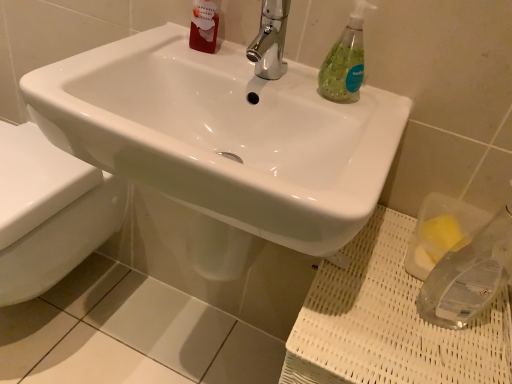
You are a GUI agent. You are given a task and a screenshot of the screen. Output one action in this format:
    pyautogui.click(x=<x>, y=<y>)
    Task: Click on the vacant area that lies to the right of translucent red liquid at upper left
    Image resolution: width=512 pixels, height=384 pixels.
    Given the screenshot: What is the action you would take?
    258,71